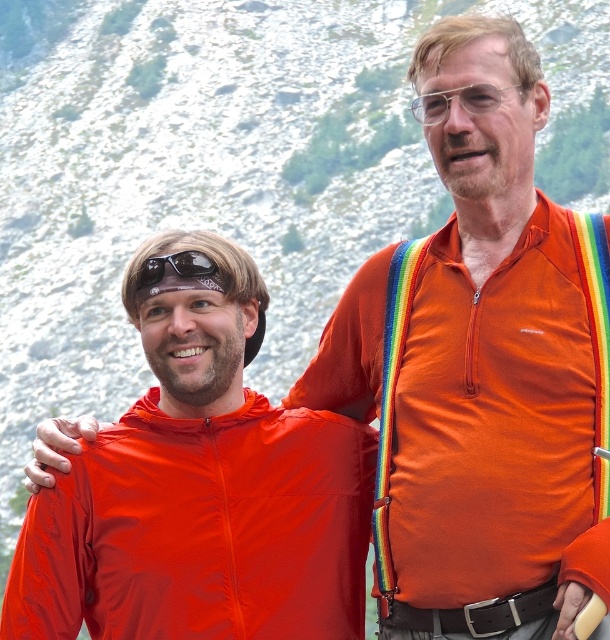
Does matte nylon jacket at left have a lesser width compared to black rubber sunglasses at upper left?

In fact, matte nylon jacket at left might be wider than black rubber sunglasses at upper left.

How distant is matte nylon jacket at left from black rubber sunglasses at upper left?

A distance of 22.78 feet exists between matte nylon jacket at left and black rubber sunglasses at upper left.

Which is in front, point (59, 598) or point (142, 278)?

Point (59, 598) is more forward.

Locate an element on the screen. The image size is (610, 640). matte nylon jacket at left is located at coordinates (201, 531).

Is matte nylon jacket at left shorter than clear plastic goggles at upper center?

In fact, matte nylon jacket at left may be taller than clear plastic goggles at upper center.

How distant is matte nylon jacket at left from clear plastic goggles at upper center?

The distance of matte nylon jacket at left from clear plastic goggles at upper center is 13.78 meters.

This screenshot has width=610, height=640. I want to click on matte nylon jacket at left, so (x=201, y=531).

This screenshot has width=610, height=640. Identify the location of matte nylon jacket at left. (201, 531).

Who is shorter, orange fabric jacket at center or black rubber sunglasses at upper left?

With less height is black rubber sunglasses at upper left.

Can you confirm if orange fabric jacket at center is smaller than black rubber sunglasses at upper left?

No.

Who is more distant from viewer, (375, 320) or (152, 266)?

The point (375, 320) is behind.

Identify the location of orange fabric jacket at center. (479, 410).